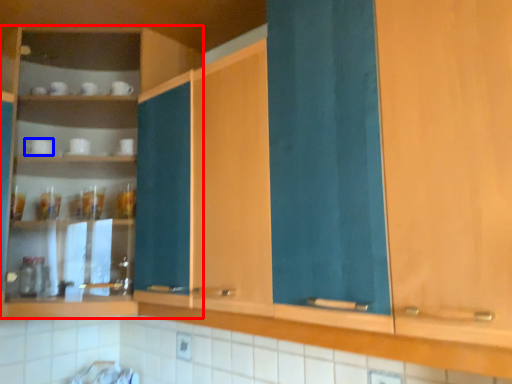
Question: Which object appears farthest to the camera in this image, cabinetry (highlighted by a red box) or tableware (highlighted by a blue box)?

Choices:
 (A) cabinetry
 (B) tableware

Answer: (B)